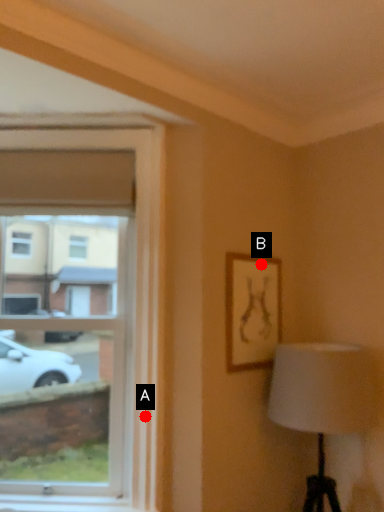
Question: Two points are circled on the image, labeled by A and B beside each circle. Which point is closer to the camera?

Choices:
 (A) A is closer
 (B) B is closer

Answer: (A)